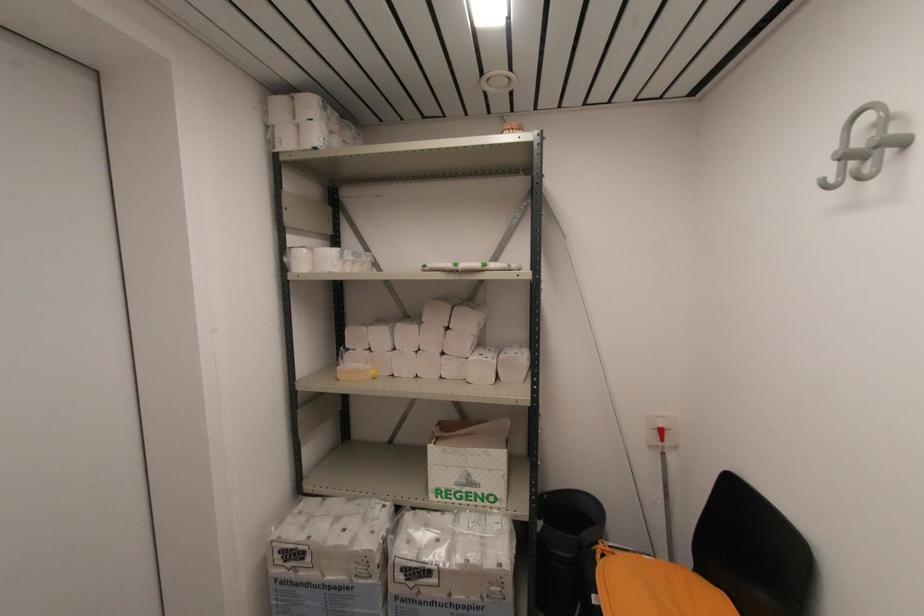
Where would you lift the yellow tape dispenser? Please return your answer as a coordinate pair (x, y).

(355, 371)